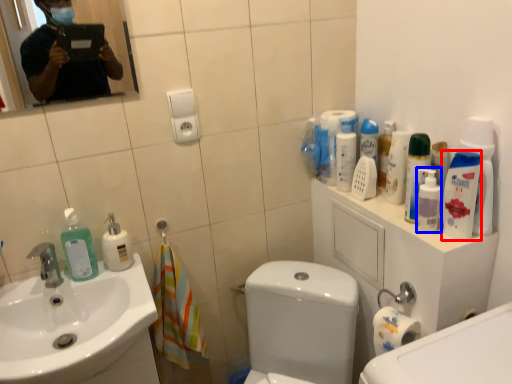
Question: Which object is further to the camera taking this photo, mouthwash (highlighted by a red box) or cleaning product (highlighted by a blue box)?

Choices:
 (A) mouthwash
 (B) cleaning product

Answer: (B)